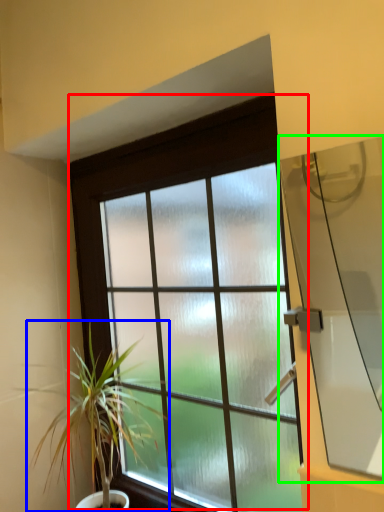
Question: Which is farther away from window (highlighted by a red box)? houseplant (highlighted by a blue box) or window screen (highlighted by a green box)?

Choices:
 (A) houseplant
 (B) window screen

Answer: (B)